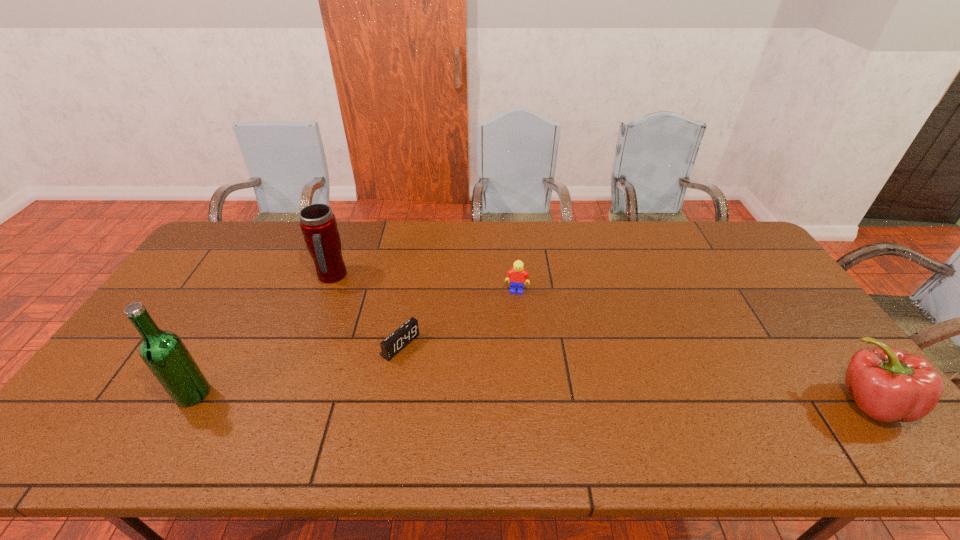
This screenshot has width=960, height=540. In order to click on vacant region located on the back of the leftmost object in this screenshot , I will do `click(232, 326)`.

Identify the location of vacant region located on the back of the third tallest object. The width and height of the screenshot is (960, 540). (825, 342).

The width and height of the screenshot is (960, 540). In order to click on vacant region located on the front-facing side of the shortest object in this screenshot , I will do pos(453,382).

The height and width of the screenshot is (540, 960). Find the location of `vacant space located on the front-facing side of the shortest object`. vacant space located on the front-facing side of the shortest object is located at coordinates (462, 388).

The image size is (960, 540). I want to click on free space located 0.260m on the front-facing side of the shortest object, so click(491, 407).

You are a GUI agent. You are given a task and a screenshot of the screen. Output one action in this format:
    pyautogui.click(x=<x>, y=<y>)
    Task: Click on the vacant area located on the side with the handle of the fourth shortest object
    Image resolution: width=960 pixels, height=540 pixels.
    Given the screenshot: What is the action you would take?
    pyautogui.click(x=395, y=322)

Find the location of a particular element. This screenshot has width=960, height=540. free space located 0.340m on the side with the handle of the fourth shortest object is located at coordinates (417, 337).

What are the coordinates of `free location located on the side with the handle of the fourth shortest object` in the screenshot? It's located at (363, 301).

You are a GUI agent. You are given a task and a screenshot of the screen. Output one action in this format:
    pyautogui.click(x=<x>, y=<y>)
    Task: Click on the vacant space located on the front-facing side of the fourth tallest object
    This screenshot has height=540, width=960.
    Given the screenshot: What is the action you would take?
    pyautogui.click(x=514, y=308)

The height and width of the screenshot is (540, 960). Identify the location of vacant space located 0.110m on the front-facing side of the fourth tallest object. (512, 321).